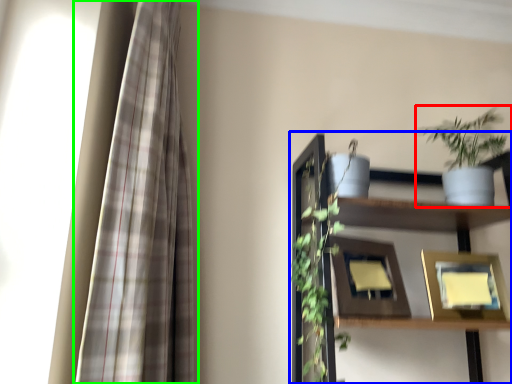
Question: Which object is the farthest from houseplant (highlighted by a red box)? Choose among these: shelf (highlighted by a blue box) or curtain (highlighted by a green box).

Choices:
 (A) shelf
 (B) curtain

Answer: (B)